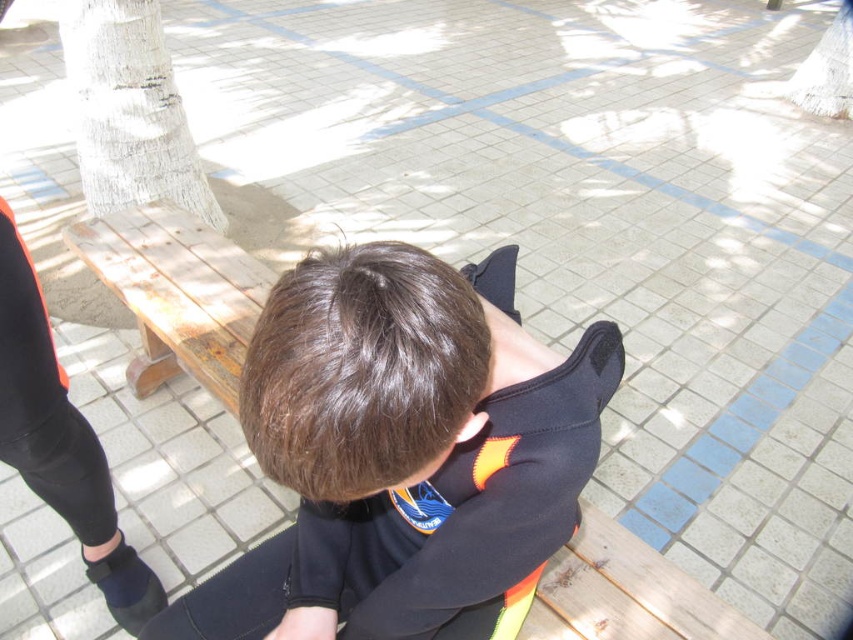
Question: Does black matte jacket at center appear on the right side of rusty wood bench at left?

Choices:
 (A) yes
 (B) no

Answer: (A)

Question: Does black matte jacket at center come in front of rusty wood bench at left?

Choices:
 (A) yes
 (B) no

Answer: (A)

Question: Which point appears closest to the camera in this image?

Choices:
 (A) (219, 384)
 (B) (291, 454)

Answer: (B)

Question: Where is black matte jacket at center located in relation to rusty wood bench at left in the image?

Choices:
 (A) above
 (B) below

Answer: (B)

Question: Which point is closer to the camera?

Choices:
 (A) rusty wood bench at left
 (B) black matte jacket at center

Answer: (B)